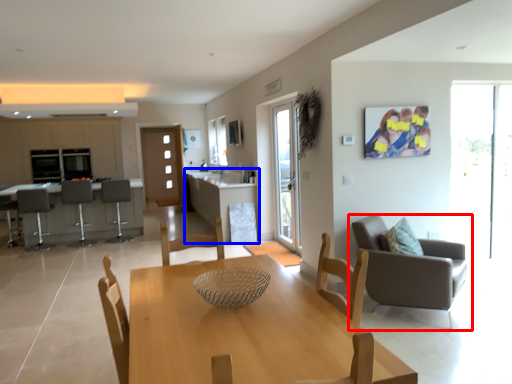
Question: Which object is closer to the camera taking this photo, chair (highlighted by a red box) or table (highlighted by a blue box)?

Choices:
 (A) chair
 (B) table

Answer: (A)